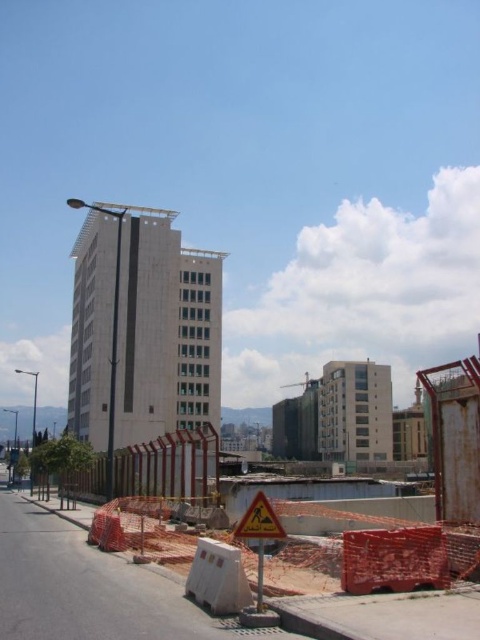
From the picture: You are standing at the origin point of this urban scene. You want to walk towards the white smooth building at center. Which direction should you move in?

You should move towards the coordinates point at (143, 328) to reach the white smooth building at center.

Consider the image. You are a delivery person trying to navigate through the construction site. You see the orange mesh fence at center and the yellow reflective triangle at center. Which object is taller?

The orange mesh fence at center is much taller than the yellow reflective triangle at center.

Based on the coordinates provided in the image, can you identify the object located at point (x=143, y=328)?

The point (x=143, y=328) indicates a white smooth building at center.